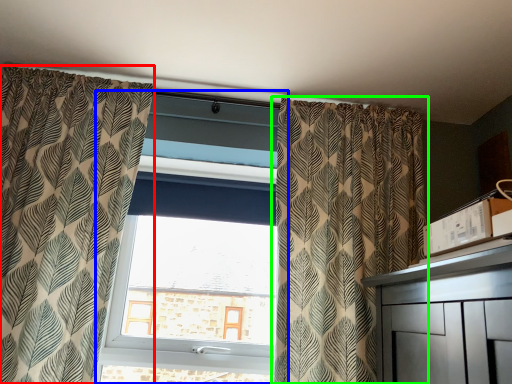
Question: Which object is the farthest from curtain (highlighted by a red box)? Choose among these: window (highlighted by a blue box) or curtain (highlighted by a green box).

Choices:
 (A) window
 (B) curtain

Answer: (B)